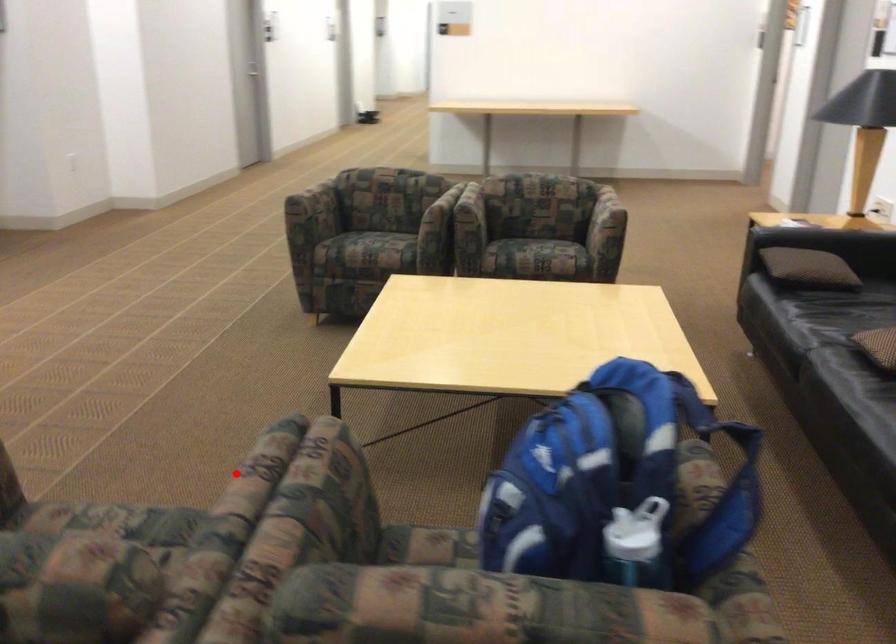
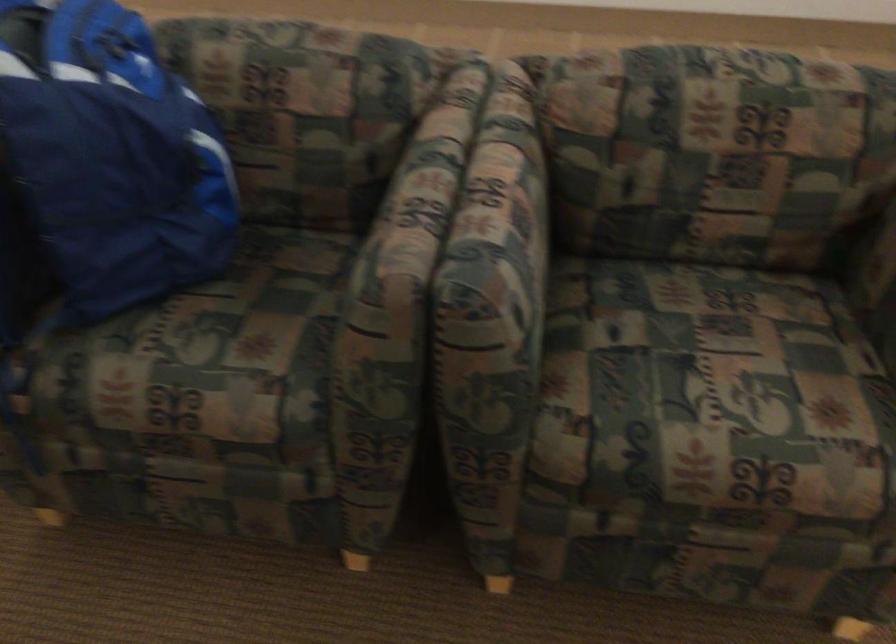
Find the pixel in the second image that matches the highlighted location in the first image.

(510, 196)